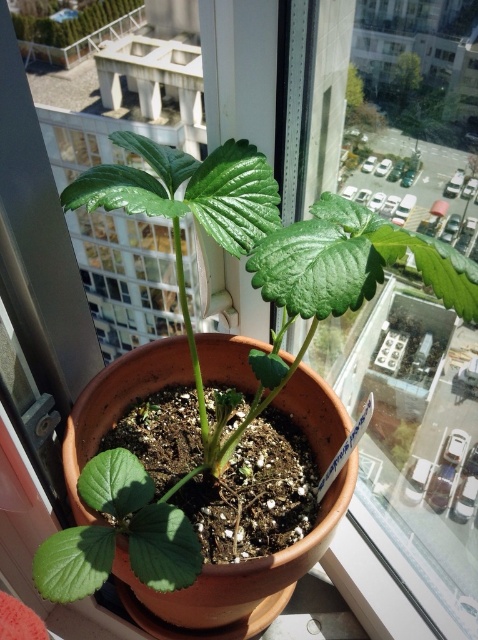
Is green matte leaf at lower left below green matte plant at upper center?

Yes, green matte leaf at lower left is below green matte plant at upper center.

Describe the element at coordinates (119, 532) in the screenshot. The image size is (478, 640). I see `green matte leaf at lower left` at that location.

What are the coordinates of `green matte leaf at lower left` in the screenshot? It's located at (119, 532).

Which is above, green matte plant at center or green matte plant at upper center?

green matte plant at upper center is higher up.

Which is behind, point (153, 509) or point (105, 19)?

Point (105, 19)

Between point (86, 589) and point (49, 29), which one is positioned behind?

The point (49, 29) is more distant.

Where is `green matte plant at center`? The image size is (478, 640). green matte plant at center is located at coordinates coord(250,349).

Does green matte plant at center have a greater height compared to green matte leaf at lower left?

Correct, green matte plant at center is much taller as green matte leaf at lower left.

Between green matte plant at center and green matte leaf at lower left, which one is positioned lower?

green matte leaf at lower left is below.

The width and height of the screenshot is (478, 640). In order to click on green matte plant at center in this screenshot , I will do `click(250, 349)`.

This screenshot has width=478, height=640. In order to click on green matte plant at center in this screenshot , I will do `click(250, 349)`.